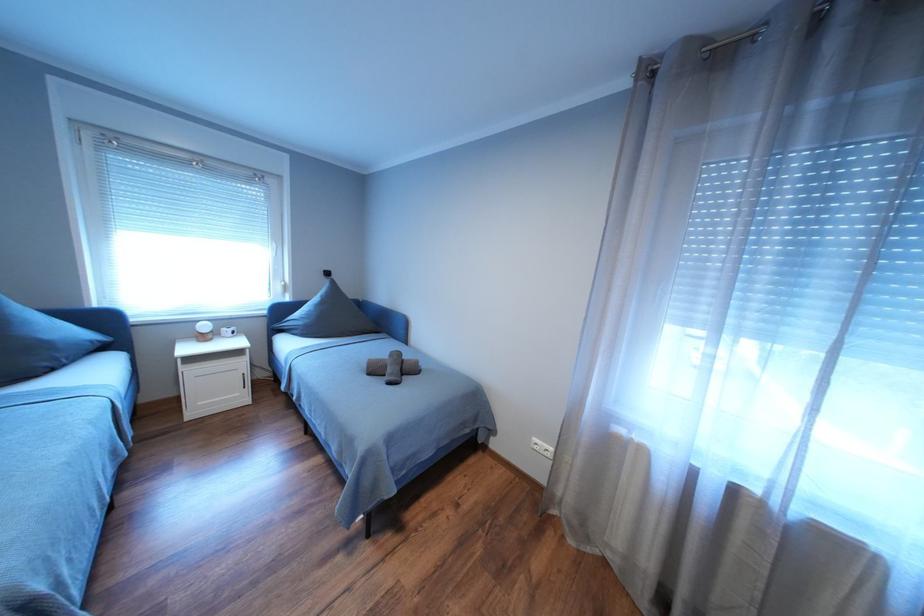
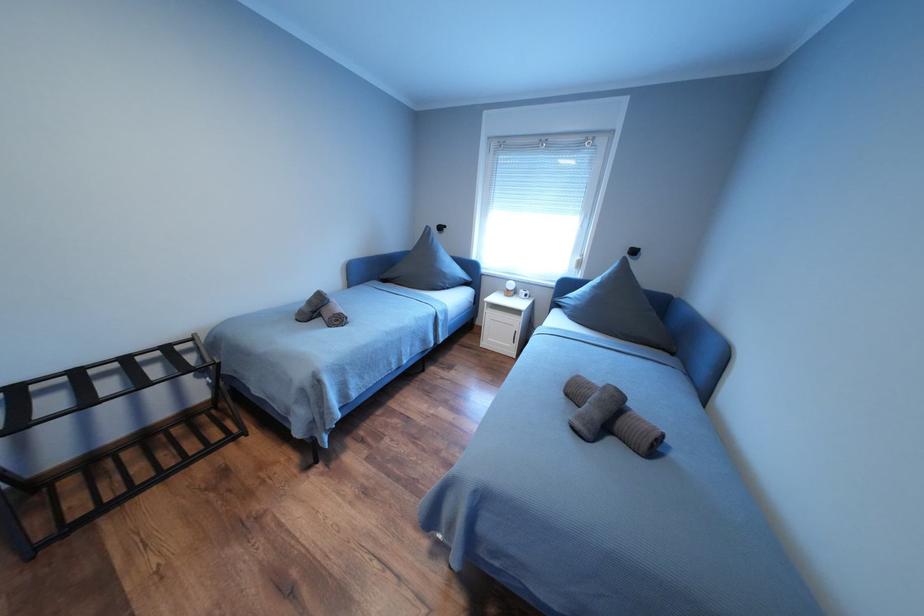
Question: The images are taken continuously from a first-person perspective. In which direction is your viewpoint rotating?

Choices:
 (A) Left
 (B) Right
 (C) Up
 (D) Down

Answer: (A)